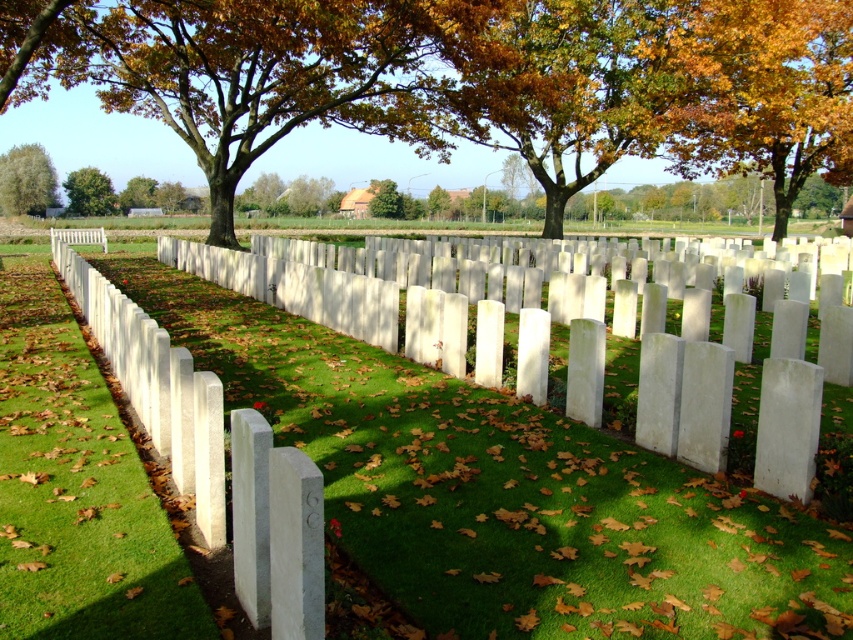
You are standing in the cemetery and want to take a photo of both the white stone markers at center and the green leafy tree at left. Which object should you focus on first to ensure both are in clear view?

You should focus on the white stone markers at center first because it is closer to you than the green leafy tree at left, ensuring both are in focus when taking the photo.

You are standing at the entrance of the cemetery and want to take a photo of the two points marked in the image. Which point, point (x=4, y=291) or point (x=22, y=193), is closer to you and should be in focus first?

Point (x=4, y=291) is closer to the camera than point (x=22, y=193), so it should be in focus first.

You are standing in the cemetery looking at the golden leafy tree at upper right and the green leafy tree at upper left. Which tree appears closer to you?

The golden leafy tree at upper right appears closer to you because it is in front of the green leafy tree at upper left.